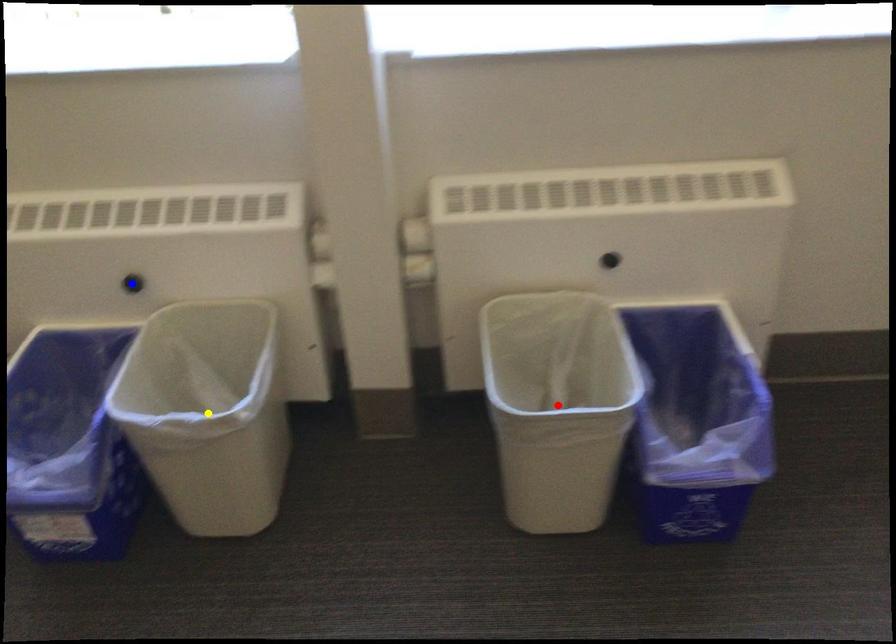
Order these from nearest to farthest:
1. red point
2. blue point
3. yellow point

yellow point, blue point, red point